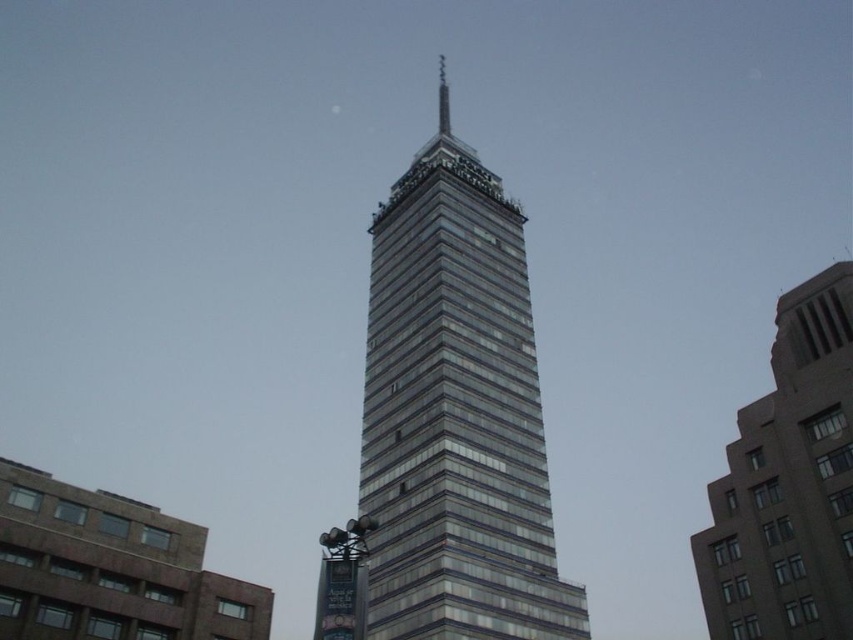
You are a city planner analyzing the skyline. You need to determine which of the two buildings, the glassy steel tower at center or the gray concrete building at right, occupies more visual space in the image. Based on the scene description, which one is larger?

The glassy steel tower at center is larger in size than the gray concrete building at right, so it occupies more visual space in the image.

You are standing in the middle of a city square and see the glassy steel tower at center and the gray concrete building at right. Which building is closer to your right side?

The gray concrete building at right is closer to your right side because the glassy steel tower at center is positioned on the left side of gray concrete building at right.

You are standing in the city square and want to take a photo of the glassy steel tower at center and the gray concrete building at right. Which building should you stand closer to in order to capture both in a single frame?

You should stand closer to the gray concrete building at right because the glassy steel tower at center is positioned over it, so moving closer to the nearer building will help include both in the frame.